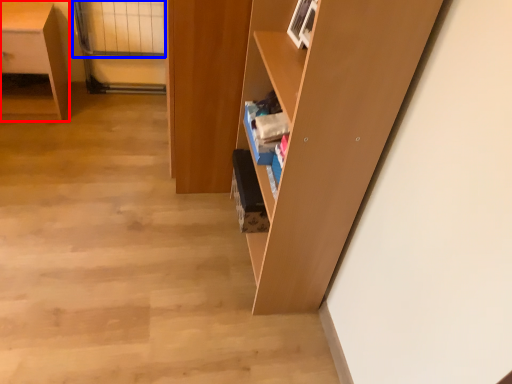
Question: Among these objects, which one is farthest to the camera, desk (highlighted by a red box) or glass door (highlighted by a blue box)?

Choices:
 (A) desk
 (B) glass door

Answer: (B)